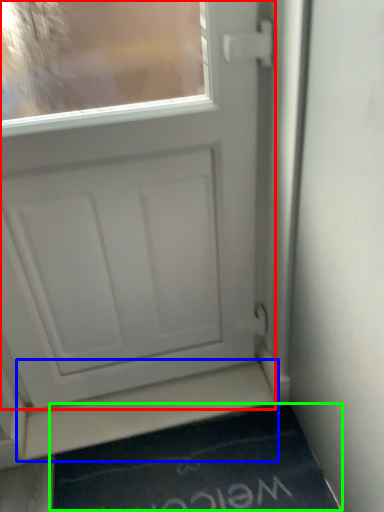
Question: Which object is the farthest from door (highlighted by a red box)? Choose among these: stairwell (highlighted by a blue box) or doormat (highlighted by a green box).

Choices:
 (A) stairwell
 (B) doormat

Answer: (B)